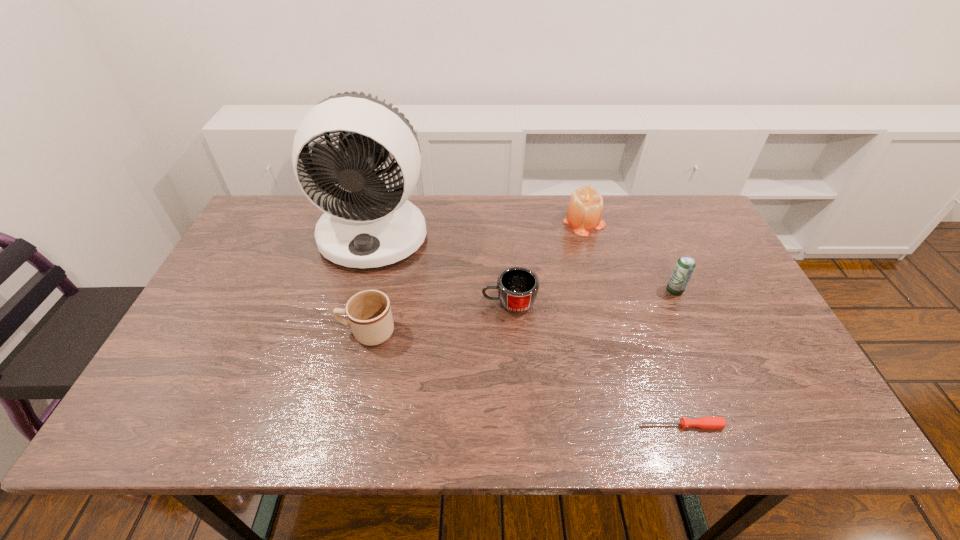
At what (x,y) coordinates should I click in order to perform the action: click on the tallest object. Please return your answer as a coordinate pair (x, y). The width and height of the screenshot is (960, 540). Looking at the image, I should click on (366, 226).

Where is `candle`? candle is located at coordinates (584, 212).

Image resolution: width=960 pixels, height=540 pixels. Find the location of `beer can`. beer can is located at coordinates (682, 272).

This screenshot has width=960, height=540. I want to click on the left mug, so click(369, 314).

Locate an element on the screen. Image resolution: width=960 pixels, height=540 pixels. the shorter mug is located at coordinates (517, 287).

Find the location of a particular element. the right mug is located at coordinates (517, 287).

The height and width of the screenshot is (540, 960). Find the location of `screwdriver`. screwdriver is located at coordinates (703, 422).

Identify the location of the shortest object. The width and height of the screenshot is (960, 540). (703, 422).

At what (x,y) coordinates should I click in order to perform the action: click on free location located 0.230m on the grille of the tallest object. Please return your answer as a coordinate pair (x, y). This screenshot has height=540, width=960. Looking at the image, I should click on (348, 338).

I want to click on vacant space located 0.400m on the front of the candle, so click(x=615, y=340).